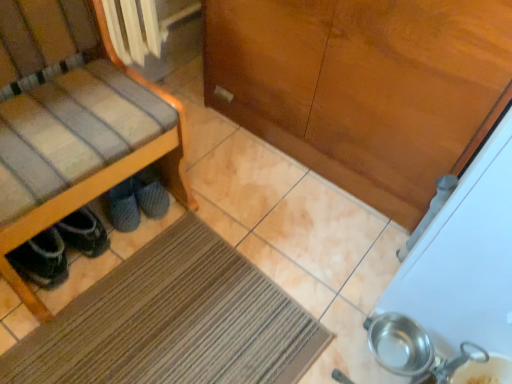
Find the location of a particular element. This screenshot has height=384, width=512. vacant space to the left of wooden cabinet at center is located at coordinates (221, 148).